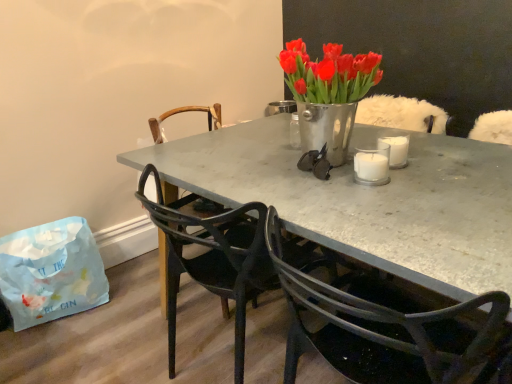
Where is `vacant space situated on the left part of matte black chair at center, which is the second chair in front-to-back order`? vacant space situated on the left part of matte black chair at center, which is the second chair in front-to-back order is located at coordinates (135, 301).